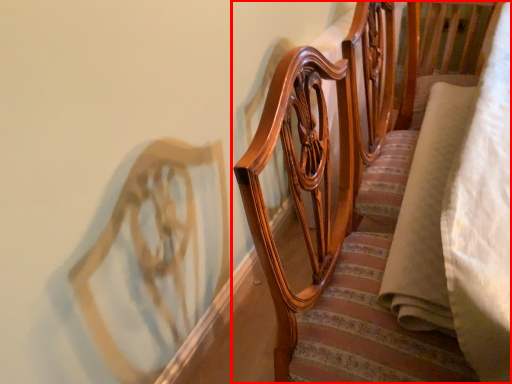
Question: From the image, what is the correct spatial relationship of furniture (annotated by the red box) in relation to fabric?

Choices:
 (A) left
 (B) right

Answer: (A)